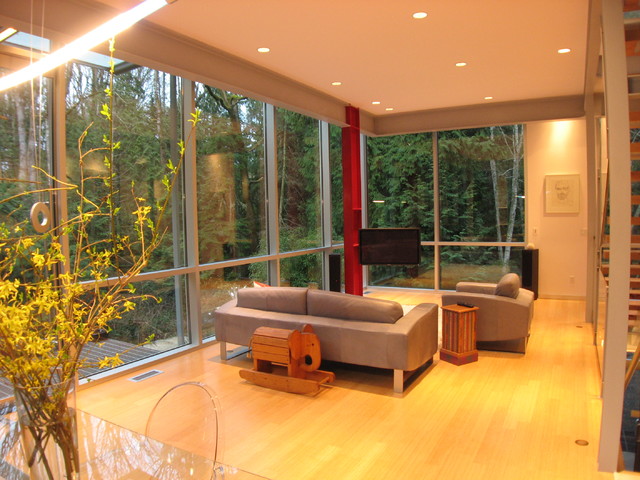
You are a GUI agent. You are given a task and a screenshot of the screen. Output one action in this format:
    pyautogui.click(x=<x>, y=<y>)
    Task: Click on the glass
    This screenshot has width=640, height=480.
    Given the screenshot: What is the action you would take?
    pyautogui.click(x=140, y=457)